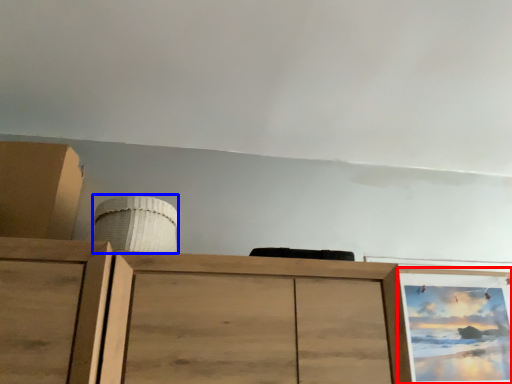
Question: Which point is closer to the camera, picture frame (highlighted by a red box) or job (highlighted by a blue box)?

Choices:
 (A) picture frame
 (B) job

Answer: (B)